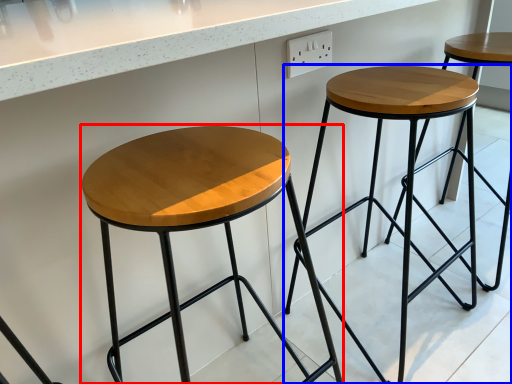
Question: Which of the following is the closest to the observer, stool (highlighted by a red box) or stool (highlighted by a blue box)?

Choices:
 (A) stool
 (B) stool

Answer: (A)